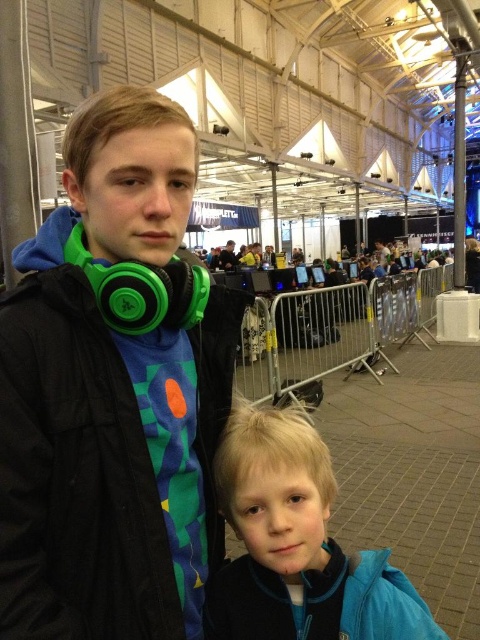
Question: Among these objects, which one is farthest from the camera?

Choices:
 (A) blue fleece jacket at lower right
 (B) green matte headphones at upper left

Answer: (A)

Question: Is blue fleece jacket at lower right to the right of matte black headphones at upper left from the viewer's perspective?

Choices:
 (A) yes
 (B) no

Answer: (A)

Question: Which of these objects is positioned farthest from the green matte headphones at upper left?

Choices:
 (A) blue fleece jacket at lower right
 (B) matte black headphones at upper left

Answer: (B)

Question: Can you confirm if blue fleece jacket at lower right is positioned to the right of matte black headphones at upper left?

Choices:
 (A) no
 (B) yes

Answer: (B)

Question: Which of the following is the closest to the observer?

Choices:
 (A) matte black headphones at upper left
 (B) green matte headphones at upper left
 (C) blue fleece jacket at lower right

Answer: (B)

Question: Can you confirm if blue fleece jacket at lower right is positioned to the left of matte black headphones at upper left?

Choices:
 (A) yes
 (B) no

Answer: (B)